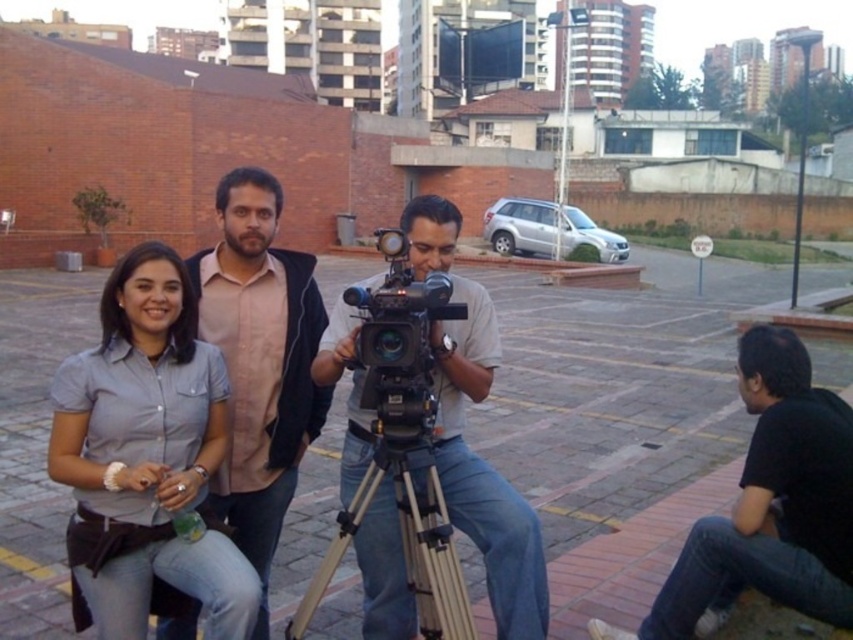
Question: Which point appears closest to the camera in this image?

Choices:
 (A) (306, 612)
 (B) (426, 292)

Answer: (B)

Question: Is matte black camera at center in front of matte pink shirt at center?

Choices:
 (A) yes
 (B) no

Answer: (A)

Question: Can you confirm if black cotton shirt at lower right is smaller than matte black camera at center?

Choices:
 (A) yes
 (B) no

Answer: (B)

Question: Among these objects, which one is nearest to the camera?

Choices:
 (A) gray matte shirt at center
 (B) black plastic video camera at center

Answer: (A)

Question: Which point is farther to the camera?

Choices:
 (A) matte black camera at center
 (B) black cotton shirt at lower right

Answer: (A)

Question: Can you confirm if matte black camera at center is wider than black plastic video camera at center?

Choices:
 (A) yes
 (B) no

Answer: (A)